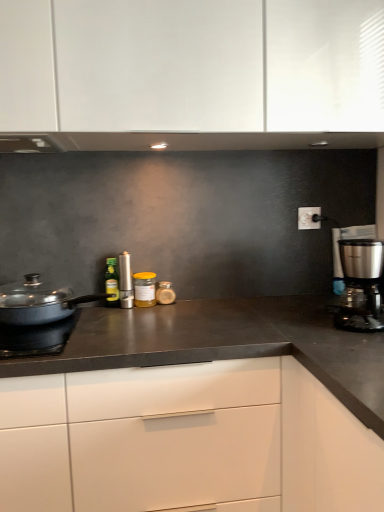
Where is `vacant space that is to the left of satin silver coffee maker at right, the fifth kitchen appliance positioned from the left`? This screenshot has width=384, height=512. vacant space that is to the left of satin silver coffee maker at right, the fifth kitchen appliance positioned from the left is located at coordinates (304, 327).